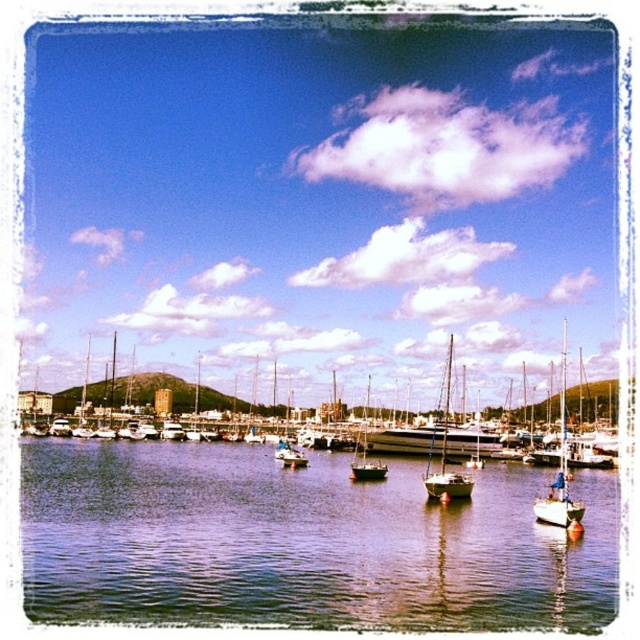
You are a photographer trying to capture the white matte sailboat at right and the white matte sailboat at center in a single shot. Which of the two sailboats appears larger in the photo?

The white matte sailboat at right appears larger in the photo because it is closer to the viewer than the white matte sailboat at center.

You are a boat operator who needs to navigate a new boat that is 50 meters long into the marina. Based on the image, is there enough space between the white matte sailboat at right and the smooth white sailboat at center to safely dock your boat?

The distance between the white matte sailboat at right and the smooth white sailboat at center is 52.35 meters. Since your boat is 50 meters long, there is sufficient space to dock safely.

You are a photographer planning to take a photo of the white matte sailboat at right and the white matte sailboat at center from the dock. Which boat will appear lower in your photo?

The white matte sailboat at right is located below the white matte sailboat at center, so it will appear lower in the photo.